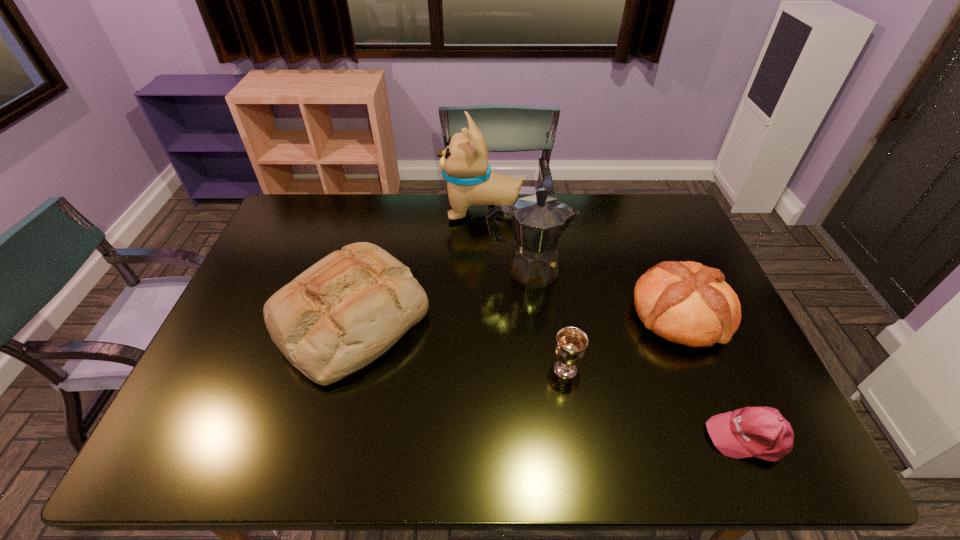
At what (x,y) coordinates should I click in order to perform the action: click on free location located on the face of the puppy. Please return your answer as a coordinate pair (x, y). The image size is (960, 540). Looking at the image, I should click on (420, 210).

At what (x,y) coordinates should I click in order to perform the action: click on vacant region located 0.070m on the pouring side of the second tallest object. Please return your answer as a coordinate pair (x, y). Looking at the image, I should click on (591, 270).

Find the location of `free space located on the back of the fourth shortest object`. free space located on the back of the fourth shortest object is located at coordinates (382, 197).

Locate an element on the screen. blank space located on the back of the right bread is located at coordinates (657, 258).

Identify the location of free space located 0.150m on the back of the fifth tallest object. This screenshot has width=960, height=540. (557, 313).

Image resolution: width=960 pixels, height=540 pixels. Find the location of `free space located at the front of the nearest object with the brim`. free space located at the front of the nearest object with the brim is located at coordinates (672, 437).

Locate an element on the screen. The height and width of the screenshot is (540, 960). free spot located at the front of the nearest object with the brim is located at coordinates (628, 437).

At what (x,y) coordinates should I click in order to perform the action: click on blank space located at the front of the nearest object with the brim. Please return your answer as a coordinate pair (x, y). The image size is (960, 540). Looking at the image, I should click on (536, 437).

This screenshot has height=540, width=960. Identify the location of object that is at the far edge. (464, 163).

The image size is (960, 540). Find the location of `object located at the near edge`. object located at the near edge is located at coordinates (762, 432).